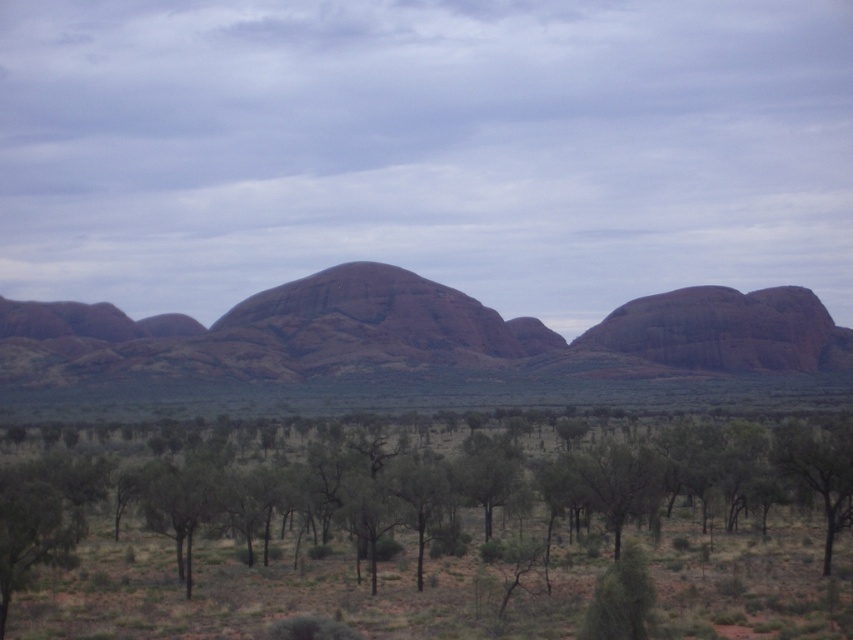
Based on the photo, can you confirm if rustic rock formation at center is smaller than green leafy tree at lower right?

No, rustic rock formation at center is not smaller than green leafy tree at lower right.

Describe the element at coordinates (416, 337) in the screenshot. The image size is (853, 640). I see `rustic rock formation at center` at that location.

What do you see at coordinates (416, 337) in the screenshot? I see `rustic rock formation at center` at bounding box center [416, 337].

Find the location of `rustic rock formation at center`. rustic rock formation at center is located at coordinates (416, 337).